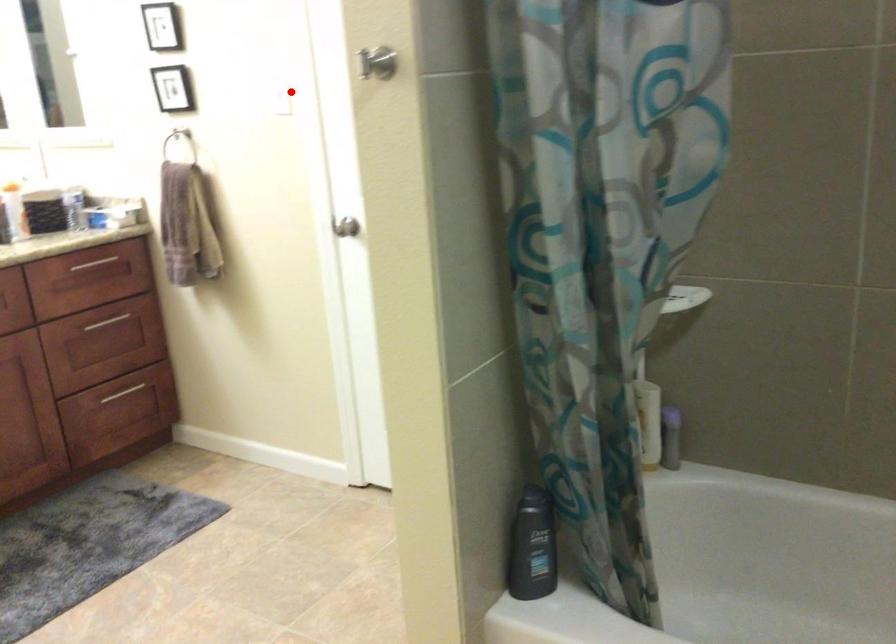
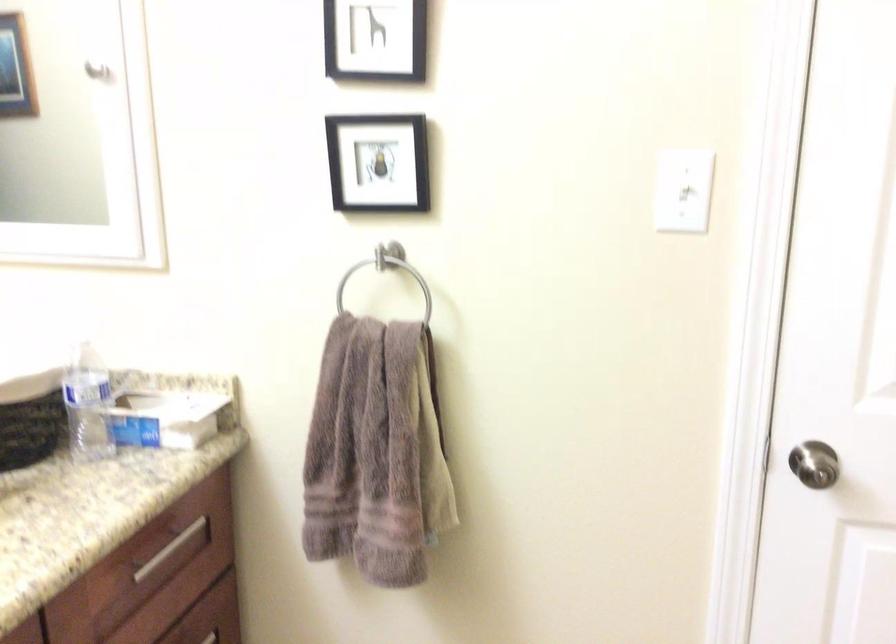
Where in the second image is the point corresponding to the highlighted location from the first image?

(683, 190)